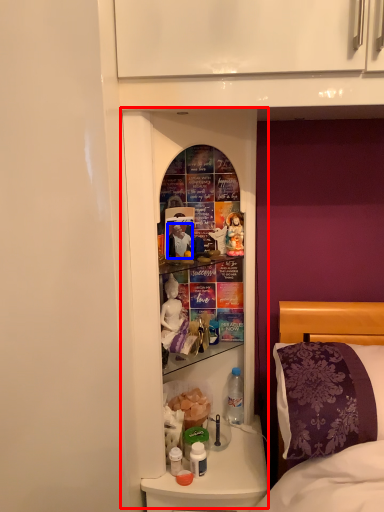
Question: Which of the following is the closest to the observer, medicine cabinet (highlighted by a red box) or person (highlighted by a blue box)?

Choices:
 (A) medicine cabinet
 (B) person

Answer: (A)